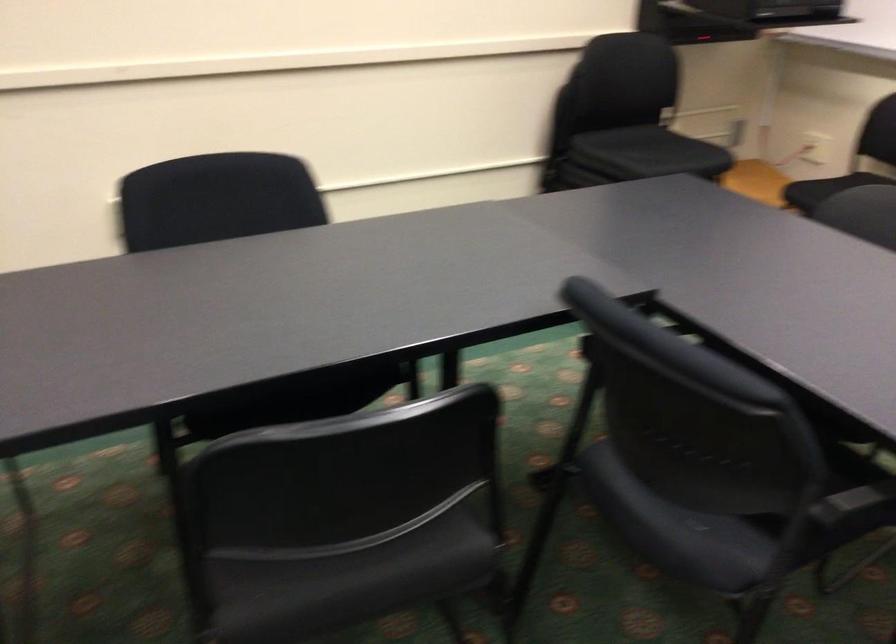
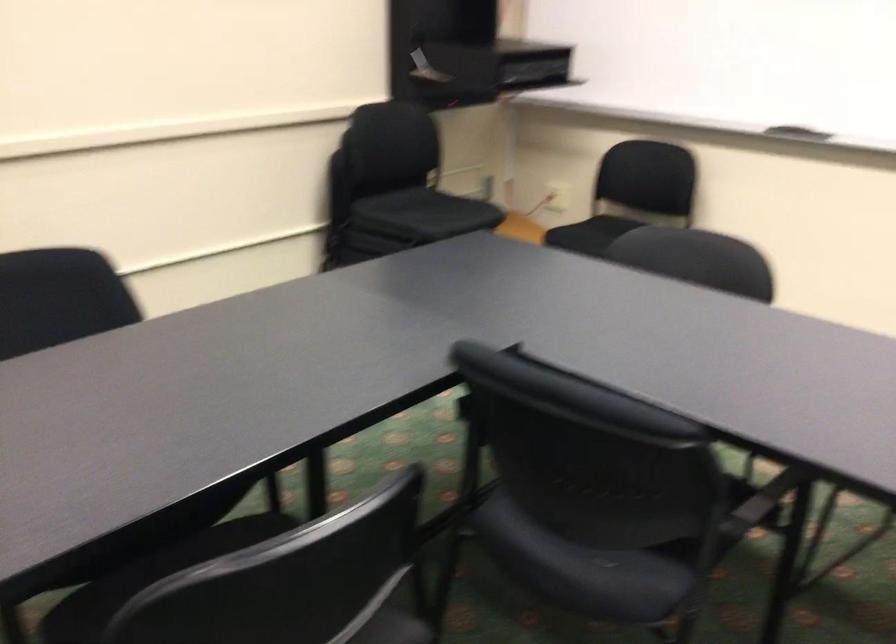
Question: Which direction would the cameraman need to move to produce the second image? Reply with the corresponding letter.

Choices:
 (A) Left
 (B) Right
 (C) Forward
 (D) Backward

Answer: (A)